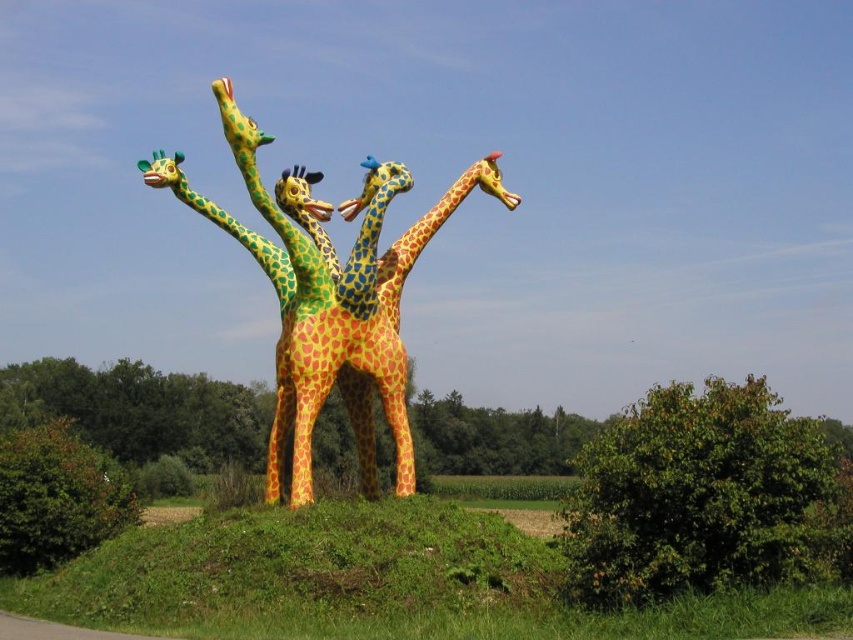
Question: Can you confirm if green leafy bush at center is positioned above green matte tree at center?

Choices:
 (A) yes
 (B) no

Answer: (A)

Question: Which point is farther to the camera?

Choices:
 (A) glossy painted giraffes at center
 (B) green matte bush at lower left
 (C) green leafy bush at center
 (D) green matte tree at center

Answer: (D)

Question: Does glossy painted giraffes at center have a larger size compared to green matte bush at lower left?

Choices:
 (A) yes
 (B) no

Answer: (B)

Question: Among these objects, which one is farthest from the camera?

Choices:
 (A) glossy painted giraffes at center
 (B) green leafy bush at center
 (C) green matte tree at center
 (D) green matte bush at lower left

Answer: (C)

Question: Which point is closer to the camera?

Choices:
 (A) glossy painted giraffes at center
 (B) green leafy bush at center
 (C) green matte tree at center

Answer: (B)

Question: From the image, what is the correct spatial relationship of glossy painted giraffes at center in relation to green matte tree at center?

Choices:
 (A) right
 (B) left

Answer: (A)